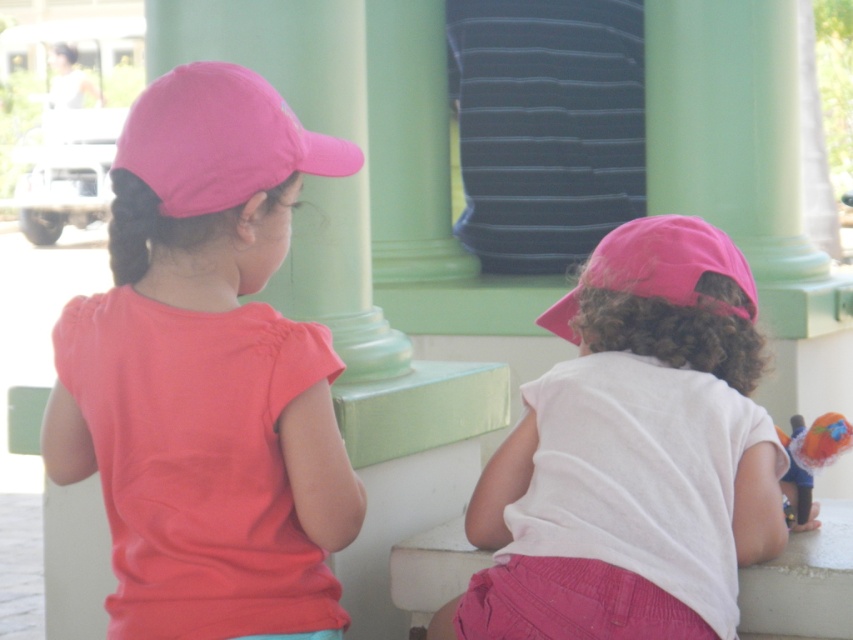
Is matte pink cap at upper left smaller than pink fabric cap at center?

Yes, matte pink cap at upper left is smaller than pink fabric cap at center.

Does point (300, 460) come behind point (669, 342)?

No, (300, 460) is closer to viewer.

The height and width of the screenshot is (640, 853). Identify the location of matte pink cap at upper left. (207, 372).

Is pink fabric cap at upper left behind pink matte baseball cap at center?

No, pink fabric cap at upper left is closer to the viewer.

This screenshot has width=853, height=640. I want to click on pink fabric cap at upper left, so click(x=219, y=140).

Is matte pink cap at upper left thinner than pink matte baseball cap at center?

No.

Who is more distant from viewer, (x=323, y=160) or (x=577, y=292)?

The point (x=577, y=292) is more distant.

Is point (163, 173) closer to viewer compared to point (643, 296)?

Yes.

The image size is (853, 640). Identify the location of matte pink cap at upper left. (207, 372).